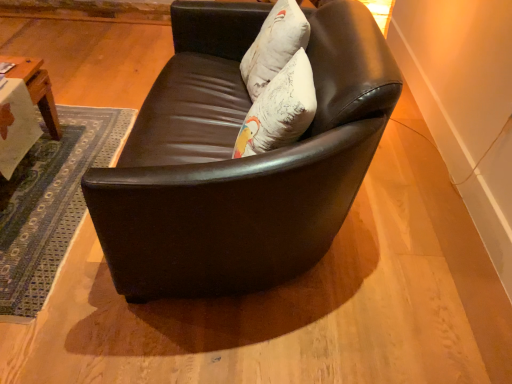
Locate an element on the screen. Image resolution: width=512 pixels, height=384 pixels. matte black couch at center is located at coordinates (239, 159).

What do you see at coordinates (239, 159) in the screenshot? This screenshot has width=512, height=384. I see `matte black couch at center` at bounding box center [239, 159].

Where is `white textured pillow at upper center`? This screenshot has width=512, height=384. white textured pillow at upper center is located at coordinates (274, 46).

Measure the distance between point (253, 62) and camera.

They are 5.47 feet apart.

Image resolution: width=512 pixels, height=384 pixels. What do you see at coordinates (274, 46) in the screenshot?
I see `white textured pillow at upper center` at bounding box center [274, 46].

You are a GUI agent. You are given a task and a screenshot of the screen. Output one action in this format:
    pyautogui.click(x=<x>, y=<y>)
    Task: Click on the matte black couch at center
    The image size is (512, 384).
    Given the screenshot: What is the action you would take?
    pyautogui.click(x=239, y=159)

Would you say matte black couch at center is to the left or to the right of white textured pillow at upper center in the picture?

matte black couch at center is to the left of white textured pillow at upper center.

Is matte black couch at center positioned in front of white textured pillow at upper center?

Yes, matte black couch at center is closer to the viewer.

Which is less distant, (x=174, y=45) or (x=304, y=37)?

Positioned in front is point (x=304, y=37).

From the image's perspective, between matte black couch at center and white textured pillow at upper center, which one is located above?

white textured pillow at upper center, from the image's perspective.

From a real-world perspective, is matte black couch at center above or below white textured pillow at upper center?

matte black couch at center is situated lower than white textured pillow at upper center in the real world.

Can you confirm if matte black couch at center is wider than white textured pillow at upper center?

Yes.

Does matte black couch at center have a lesser height compared to white textured pillow at upper center?

No.

Does matte black couch at center have a smaller size compared to white textured pillow at upper center?

Incorrect, matte black couch at center is not smaller in size than white textured pillow at upper center.

Which is correct: matte black couch at center is inside white textured pillow at upper center, or outside of it?

matte black couch at center cannot be found inside white textured pillow at upper center.

Is the surface of matte black couch at center in direct contact with white textured pillow at upper center?

There is a gap between matte black couch at center and white textured pillow at upper center.

Could you tell me if matte black couch at center is facing white textured pillow at upper center?

Yes, matte black couch at center is aimed at white textured pillow at upper center.

How many degrees apart are the facing directions of matte black couch at center and white textured pillow at upper center?

matte black couch at center and white textured pillow at upper center are facing 12.1 degrees away from each other.

How much distance is there between matte black couch at center and white textured pillow at upper center?

matte black couch at center and white textured pillow at upper center are 13.37 inches apart from each other.

This screenshot has height=384, width=512. I want to click on pillow above the matte black couch at center (from a real-world perspective), so click(x=274, y=46).

Visually, is white textured pillow at upper center positioned to the left or to the right of matte black couch at center?

Clearly, white textured pillow at upper center is on the right of matte black couch at center in the image.

Considering their positions, is white textured pillow at upper center located in front of or behind matte black couch at center?

In the image, white textured pillow at upper center appears behind matte black couch at center.

Is point (277, 3) closer to viewer compared to point (194, 104)?

That is False.

From the image's perspective, which is below, white textured pillow at upper center or matte black couch at center?

matte black couch at center, from the image's perspective.

From a real-world perspective, between white textured pillow at upper center and matte black couch at center, who is vertically lower?

In real-world perspective, matte black couch at center is lower.

Considering the sizes of objects white textured pillow at upper center and matte black couch at center in the image provided, who is thinner, white textured pillow at upper center or matte black couch at center?

white textured pillow at upper center.

Considering the relative sizes of white textured pillow at upper center and matte black couch at center in the image provided, is white textured pillow at upper center shorter than matte black couch at center?

Yes.

Looking at the image, does white textured pillow at upper center seem bigger or smaller compared to matte black couch at center?

Considering their sizes, white textured pillow at upper center takes up less space than matte black couch at center.

Is white textured pillow at upper center positioned beyond the bounds of matte black couch at center?

No.

Are white textured pillow at upper center and matte black couch at center located far from each other?

white textured pillow at upper center is near matte black couch at center, not far away.

Is white textured pillow at upper center facing towards matte black couch at center?

Yes, white textured pillow at upper center is aimed at matte black couch at center.

Measure the distance from white textured pillow at upper center to matte black couch at center.

The distance of white textured pillow at upper center from matte black couch at center is 13.37 inches.

Locate an element on the screen. studio couch lying below the white textured pillow at upper center (from the image's perspective) is located at coordinates (239, 159).

Where is `studio couch located on the left of white textured pillow at upper center`? studio couch located on the left of white textured pillow at upper center is located at coordinates (239, 159).

Where is `pillow on the right of matte black couch at center`? The width and height of the screenshot is (512, 384). pillow on the right of matte black couch at center is located at coordinates tap(274, 46).